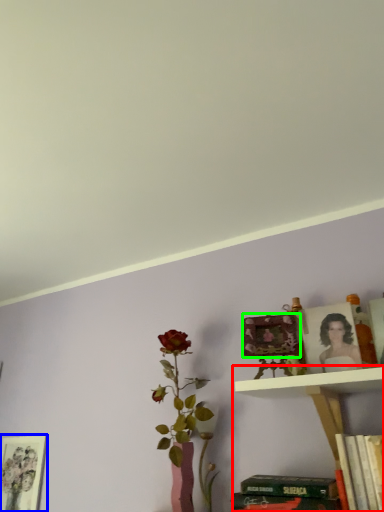
Question: Considering the real-world distances, which object is closest to shelf (highlighted by a red box)? picture frame (highlighted by a blue box) or picture frame (highlighted by a green box).

Choices:
 (A) picture frame
 (B) picture frame

Answer: (B)